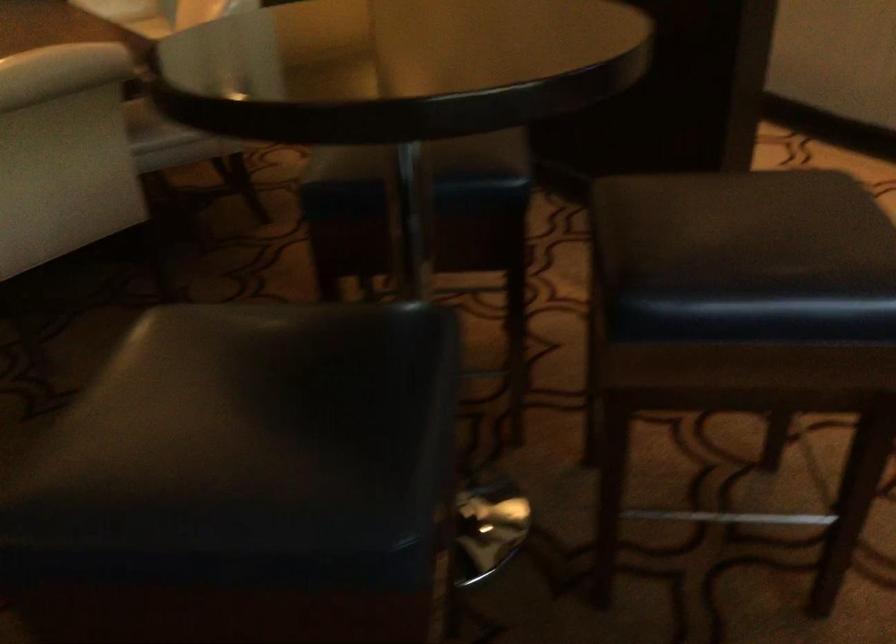
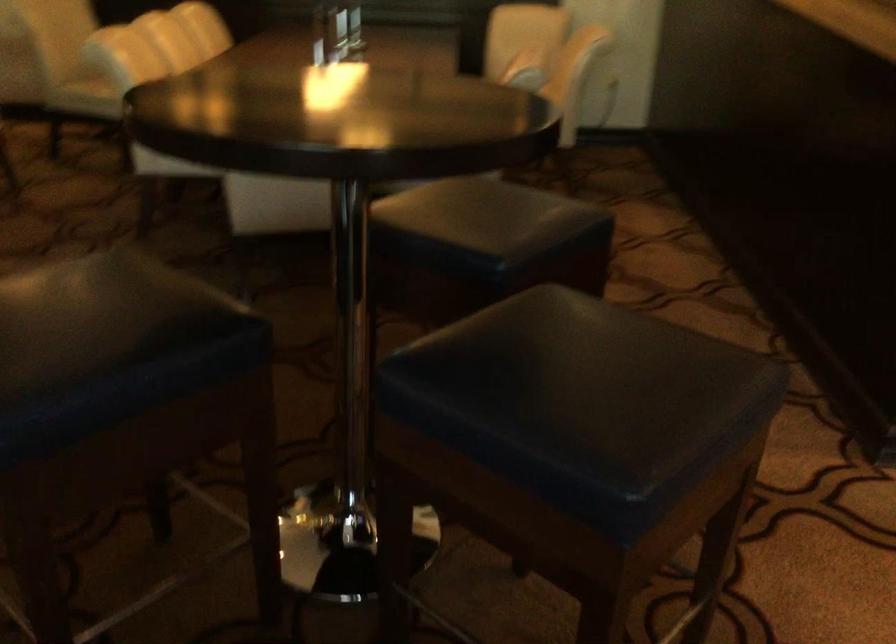
Question: The camera is either moving clockwise (left) or counter-clockwise (right) around the object. The first image is from the beginning of the video and the second image is from the end. Is the camera moving left or right when shooting the video?

Choices:
 (A) Left
 (B) Right

Answer: (B)